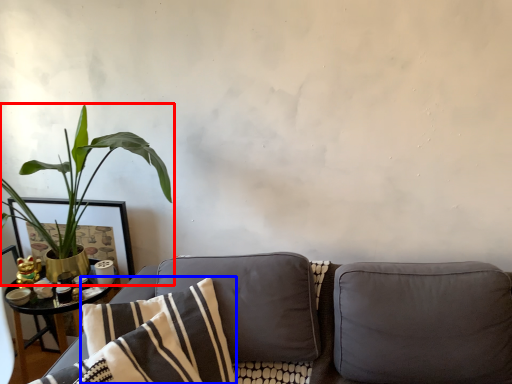
Question: Which object is further to the camera taking this photo, houseplant (highlighted by a red box) or pillow (highlighted by a blue box)?

Choices:
 (A) houseplant
 (B) pillow

Answer: (A)